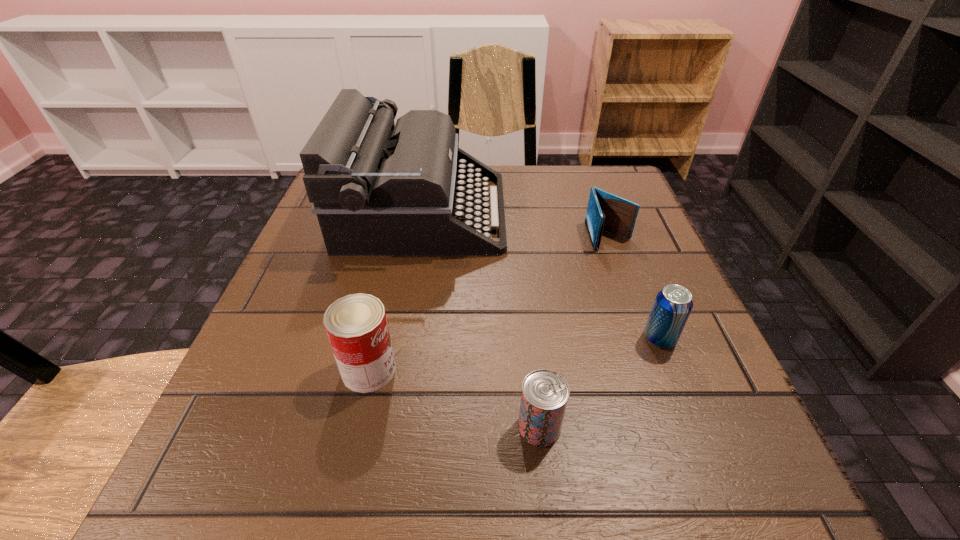
The width and height of the screenshot is (960, 540). Identify the location of vacant region that satisfies the following two spatial constraints: 1. on the typing side of the right beer can; 2. on the right side of the tallest object. (401, 339).

Identify the location of vacant position in the image that satisfies the following two spatial constraints: 1. on the front label of the left beer can; 2. on the right side of the can. (356, 427).

I want to click on blank area in the image that satisfies the following two spatial constraints: 1. on the front side of the farther beer can; 2. on the front label of the second tallest object, so click(672, 370).

Identify the location of free region that satisfies the following two spatial constraints: 1. on the front label of the nearest object; 2. on the right side of the can. (356, 427).